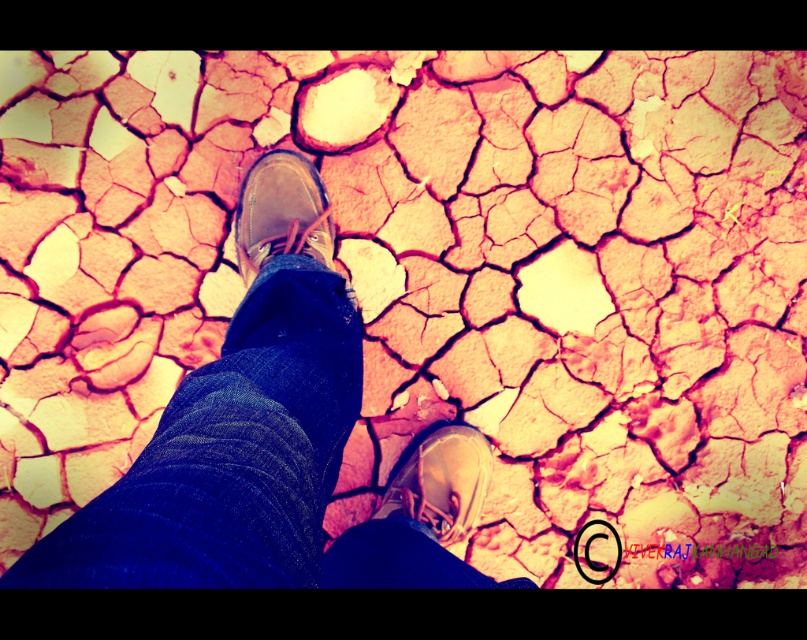
Question: Is brown leather shoes at center positioned in front of brown leather shoe at center?

Choices:
 (A) no
 (B) yes

Answer: (B)

Question: Is brown leather shoe at center closer to camera compared to matte brown shoe at center?

Choices:
 (A) no
 (B) yes

Answer: (B)

Question: Which of these objects is positioned farthest from the brown leather shoes at center?

Choices:
 (A) brown leather shoe at center
 (B) matte brown shoe at center

Answer: (B)

Question: Which object is farther from the camera taking this photo?

Choices:
 (A) brown leather shoes at center
 (B) matte brown shoe at center

Answer: (B)

Question: Does brown leather shoe at center appear under matte brown shoe at center?

Choices:
 (A) yes
 (B) no

Answer: (B)

Question: Estimate the real-world distances between objects in this image. Which object is closer to the brown leather shoes at center?

Choices:
 (A) matte brown shoe at center
 (B) brown leather shoe at center

Answer: (B)